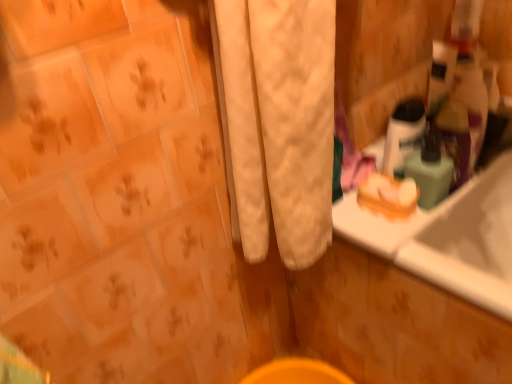
Find the location of a particular element. vacant area that is in front of translucent plastic mouthwash at upper right, arranged as the second mouthwash when viewed from the right is located at coordinates (407, 235).